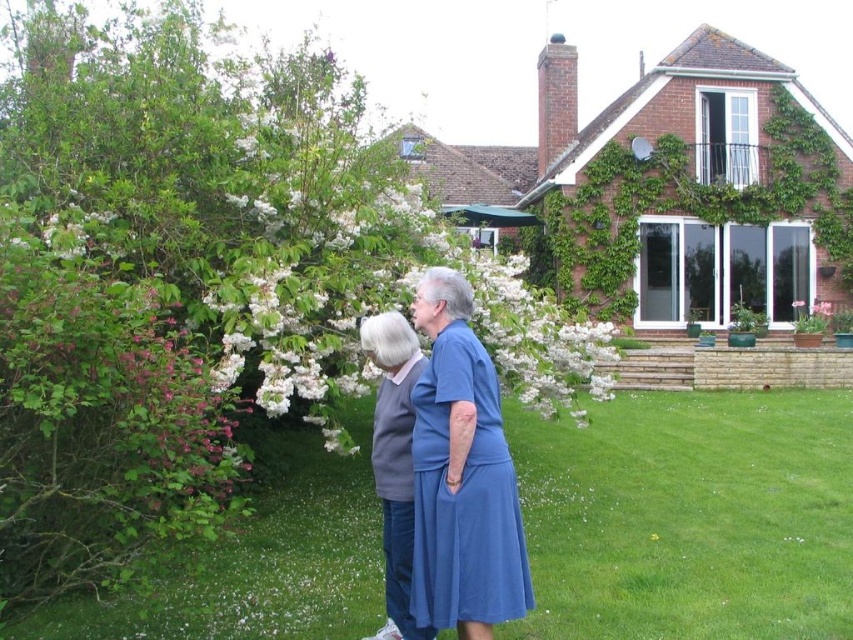
Between point (297, 484) and point (33, 301), which one is positioned in front?

Positioned in front is point (33, 301).

Is green grass at center bigger than pink glossy bush at left?

Correct, green grass at center is larger in size than pink glossy bush at left.

The width and height of the screenshot is (853, 640). I want to click on green grass at center, so click(689, 516).

Where is `green grass at center`? green grass at center is located at coordinates (689, 516).

Does white blossoms at upper center have a smaller size compared to blue fabric dress at center?

No, white blossoms at upper center is not smaller than blue fabric dress at center.

Where is `white blossoms at upper center`? white blossoms at upper center is located at coordinates 368,276.

Which is above, green grass at center or white blossoms at upper center?

white blossoms at upper center is above.

You are a GUI agent. You are given a task and a screenshot of the screen. Output one action in this format:
    pyautogui.click(x=<x>, y=<y>)
    Task: Click on the green grass at center
    The height and width of the screenshot is (640, 853).
    Given the screenshot: What is the action you would take?
    pyautogui.click(x=689, y=516)

Which is in front, point (351, 486) or point (509, 266)?

Point (509, 266)

Image resolution: width=853 pixels, height=640 pixels. Find the location of `green grass at center`. green grass at center is located at coordinates (689, 516).